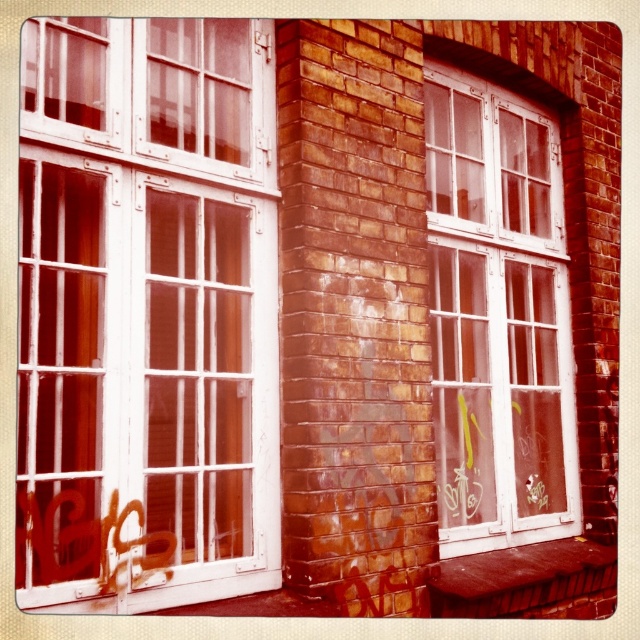
You are standing in front of a brick building with two large windows. You notice the white painted wood window frame at left. Can you tell me the 2D coordinates of its position?

The 2D coordinates of the white painted wood window frame at left are at point (147, 312).

You are an artist planning to paint a mural on the brick wall between the white painted wood window frame at left and the white glass window at right. Which window should you avoid painting over to ensure your mural doesn not cover either window?

You should avoid painting over both the white painted wood window frame at left and the white glass window at right. Since the white painted wood window frame at left is positioned on the left side of the white glass window at right, the mural should be placed between them without covering either window.

You are a painter standing 2.5 meters away from the white glass window at right. Can you reach the window to clean it with your 2.2 meter long pole?

The distance between you and the white glass window at right is 2.65 meters. Your pole is only 2.2 meters long, so you cannot reach it.